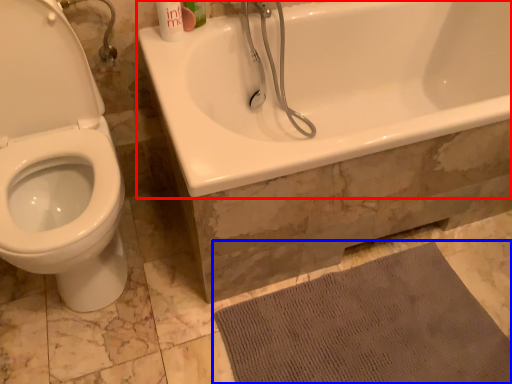
Question: Among these objects, which one is farthest to the camera, bathtub (highlighted by a red box) or bath mat (highlighted by a blue box)?

Choices:
 (A) bathtub
 (B) bath mat

Answer: (B)